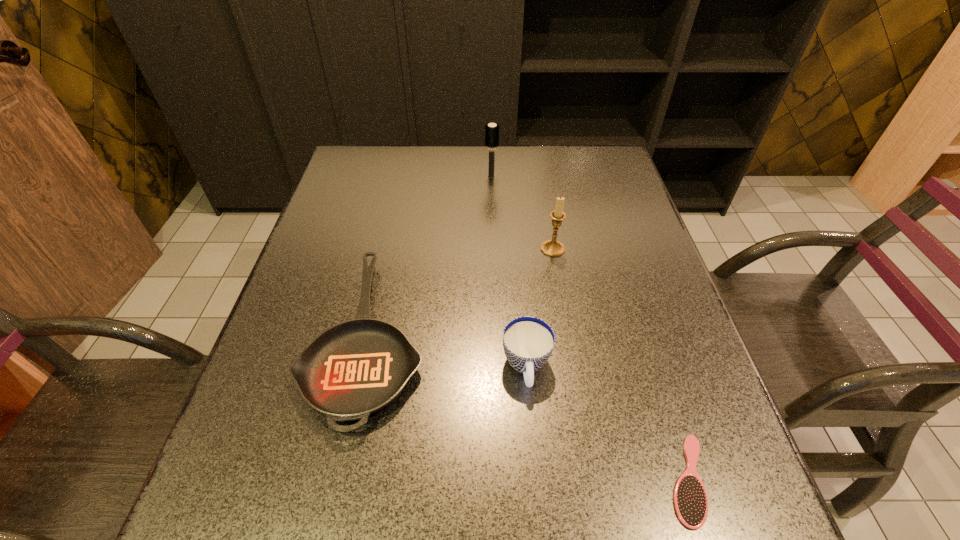
This screenshot has width=960, height=540. What are the coordinates of `blank space at the near edge of the desktop` in the screenshot? It's located at (484, 532).

Where is `vacant region at the left edge of the desktop`? The width and height of the screenshot is (960, 540). vacant region at the left edge of the desktop is located at coordinates (353, 266).

This screenshot has width=960, height=540. What are the coordinates of `vacant space at the right edge` in the screenshot? It's located at (616, 204).

This screenshot has width=960, height=540. I want to click on vacant space at the far left corner of the desktop, so click(x=374, y=156).

The image size is (960, 540). I want to click on unoccupied position between the nearer hairbrush and the taller hairbrush, so click(x=589, y=328).

At what (x,y) coordinates should I click in order to perform the action: click on vacant region between the taller hairbrush and the nearer hairbrush. Please return your answer as a coordinate pair (x, y). The width and height of the screenshot is (960, 540). Looking at the image, I should click on (589, 328).

Find the location of a particular element. The width and height of the screenshot is (960, 540). free space between the left hairbrush and the nearer hairbrush is located at coordinates [x=589, y=328].

Find the location of a particular element. free spot between the shorter hairbrush and the third shortest object is located at coordinates (608, 423).

Where is `vacant point located between the farther hairbrush and the fourth nearest object`? The width and height of the screenshot is (960, 540). vacant point located between the farther hairbrush and the fourth nearest object is located at coordinates (522, 213).

You are a GUI agent. You are given a task and a screenshot of the screen. Output one action in this format:
    pyautogui.click(x=<x>, y=<y>)
    Task: Click on the vacant region between the leftmost object and the right hairbrush
    
    Given the screenshot: What is the action you would take?
    pyautogui.click(x=528, y=408)